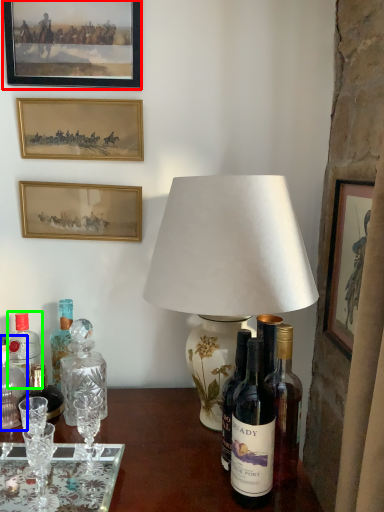
Question: Which object is positioned farthest from picture frame (highlighted by a red box)? Select from bottle (highlighted by a blue box) and bottle (highlighted by a green box).

Choices:
 (A) bottle
 (B) bottle

Answer: (A)